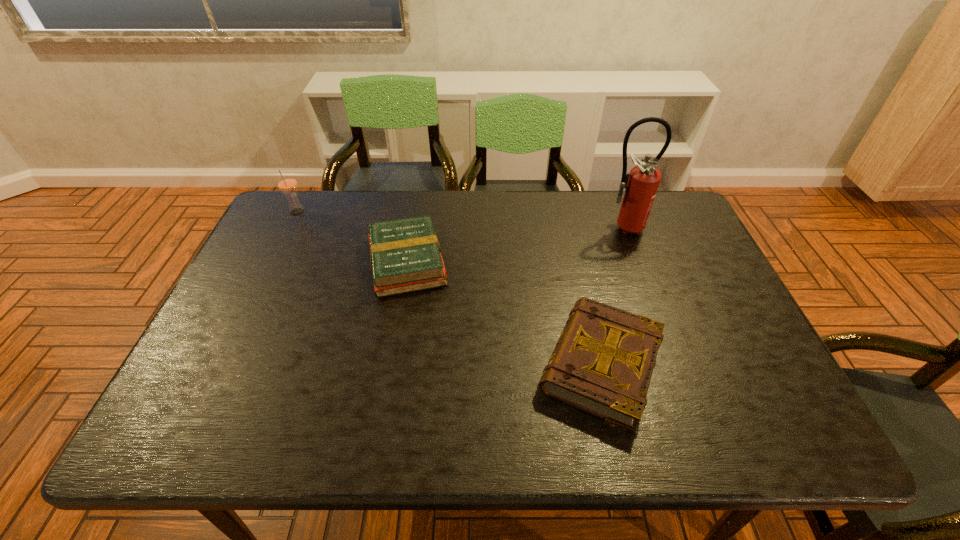
At what (x,y) coordinates should I click in order to perform the action: click on free space located on the right of the nearer hardback book. Please return your answer as a coordinate pair (x, y). This screenshot has width=960, height=540. Looking at the image, I should click on (732, 364).

Image resolution: width=960 pixels, height=540 pixels. In order to click on fire extinguisher present at the far edge in this screenshot , I will do `click(641, 184)`.

You are a GUI agent. You are given a task and a screenshot of the screen. Output one action in this format:
    pyautogui.click(x=<x>, y=<y>)
    Task: Click on the straw that is at the far edge
    The width and height of the screenshot is (960, 540).
    Given the screenshot: What is the action you would take?
    pyautogui.click(x=287, y=183)

This screenshot has width=960, height=540. I want to click on hardback book present at the far edge, so click(405, 254).

Locate an element on the screen. object at the near edge is located at coordinates pyautogui.click(x=602, y=364).

Where is `object that is at the left edge`? object that is at the left edge is located at coordinates (287, 183).

This screenshot has height=540, width=960. Identify the location of object located in the right edge section of the desktop. (641, 184).

I want to click on object located in the far left corner section of the desktop, so click(x=287, y=183).

Locate an element on the screen. The height and width of the screenshot is (540, 960). object at the far right corner is located at coordinates (641, 184).

This screenshot has width=960, height=540. In the image, there is a desktop. In order to click on free region at the far edge in this screenshot , I will do `click(504, 205)`.